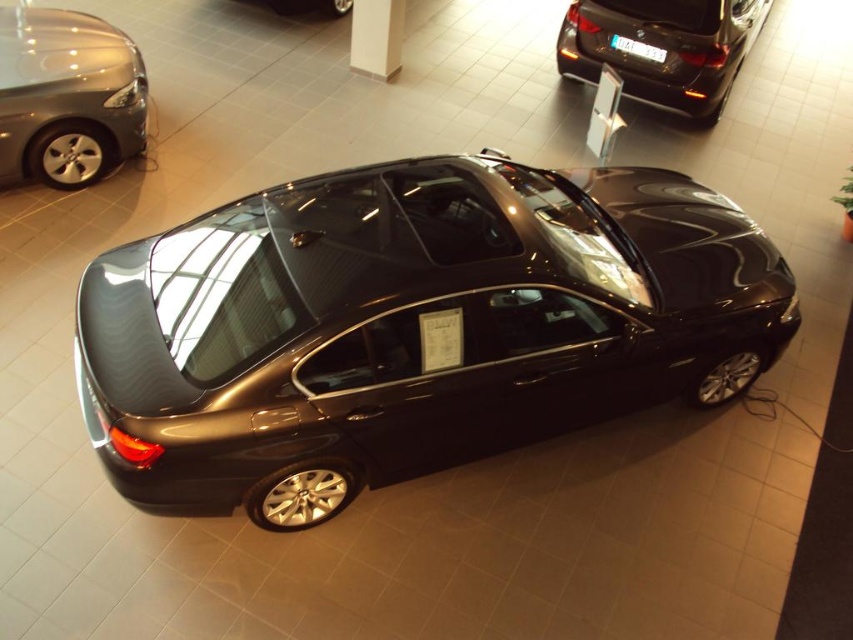
Question: Is the position of shiny metallic car at upper left less distant than that of glossy black car at upper right?

Choices:
 (A) yes
 (B) no

Answer: (A)

Question: Among these objects, which one is nearest to the camera?

Choices:
 (A) glossy metallic car at center
 (B) glossy black car at upper right

Answer: (A)

Question: Is shiny metallic car at upper left bigger than glossy metallic car at upper center?

Choices:
 (A) yes
 (B) no

Answer: (A)

Question: Can you confirm if glossy metallic car at center is wider than glossy black car at upper right?

Choices:
 (A) no
 (B) yes

Answer: (B)

Question: Among these objects, which one is nearest to the camera?

Choices:
 (A) glossy black car at upper right
 (B) glossy metallic car at upper center
 (C) shiny metallic car at upper left
 (D) glossy metallic car at center

Answer: (D)

Question: Which is farther from the glossy metallic car at upper center?

Choices:
 (A) glossy black car at upper right
 (B) shiny metallic car at upper left
 (C) glossy metallic car at center

Answer: (C)